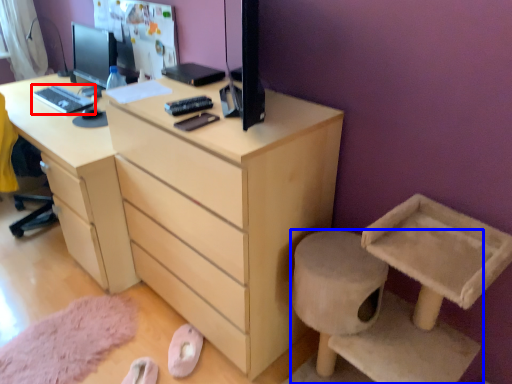
Question: Which object is further to the camera taking this photo, desktop (highlighted by a red box) or furniture (highlighted by a blue box)?

Choices:
 (A) desktop
 (B) furniture

Answer: (A)